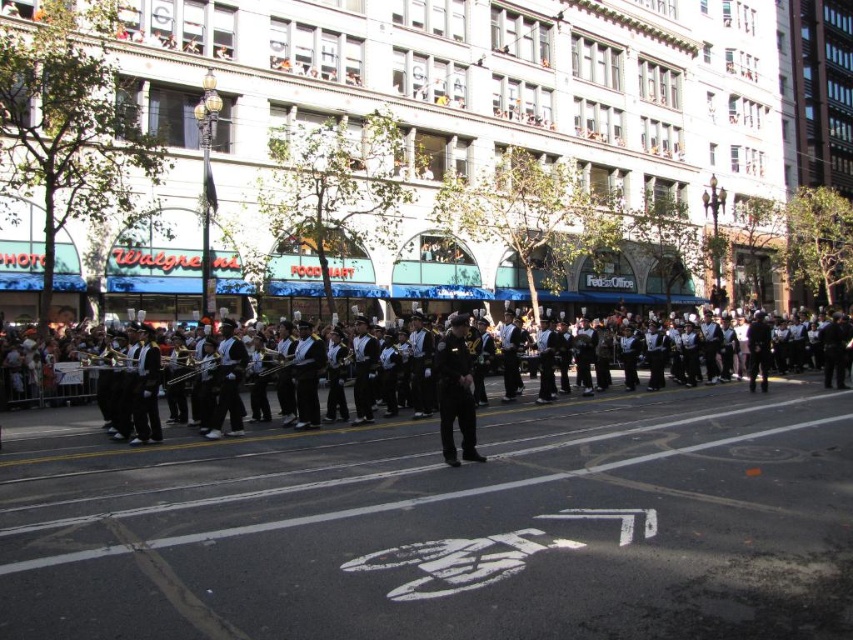
Question: Which object is closer to the camera taking this photo?

Choices:
 (A) black uniformed band at center
 (B) black uniform at center
 (C) shiny silver trumpet at center

Answer: (A)

Question: Does black uniformed band at center appear on the left side of shiny silver trumpet at center?

Choices:
 (A) no
 (B) yes

Answer: (A)

Question: Which point is farther to the camera?

Choices:
 (A) black uniformed band at center
 (B) black uniform at center
 (C) shiny silver trumpet at center

Answer: (C)

Question: Which of the following is the farthest from the observer?

Choices:
 (A) (26, 422)
 (B) (201, 358)
 (C) (468, 397)

Answer: (A)

Question: Is black uniformed band at center bigger than shiny silver trumpet at center?

Choices:
 (A) no
 (B) yes

Answer: (B)

Question: Does black uniformed band at center have a smaller size compared to shiny silver trumpet at center?

Choices:
 (A) yes
 (B) no

Answer: (B)